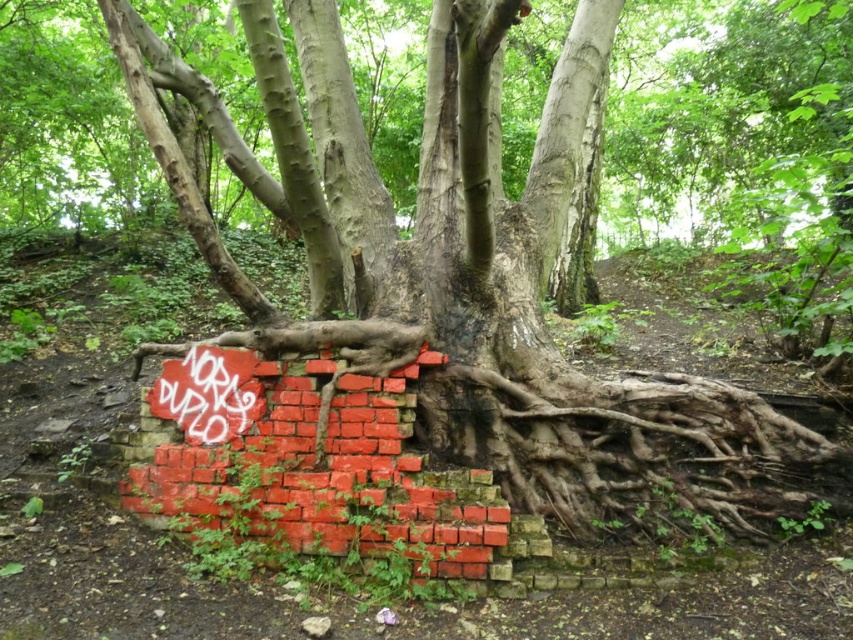
You are standing in front of the red brick wall at center and want to place a 3 feet wide decoration on the ground in front of it. Can you fit the decoration without it overlapping the wall?

The distance between you and the red brick wall at center is 7.14 feet. Since the decoration is 3 feet wide, there is enough space to place it in front of the wall without overlapping.

You are an artist planning to paint a mural on the wall. You see the red brick wall at center and the grungy graffiti at center. Which object is positioned to the right side of the other?

The red brick wall at center is to the right of grungy graffiti at center.